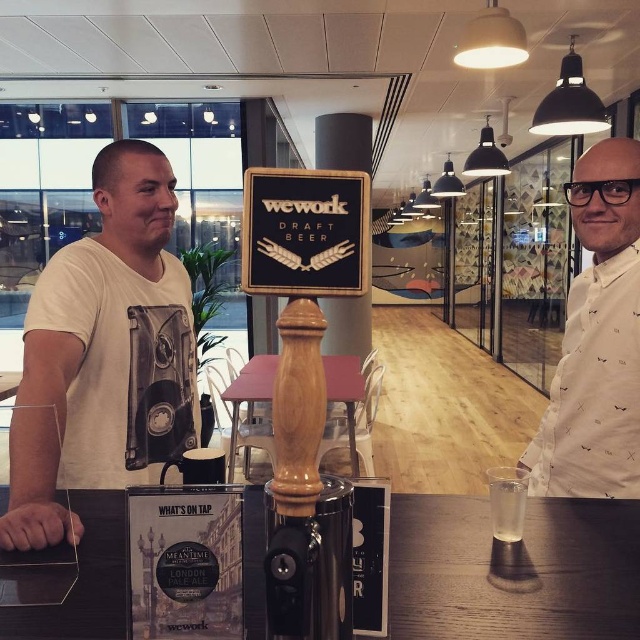
Can you confirm if white printed shirt at right is thinner than translucent glass at center?

Incorrect, white printed shirt at right's width is not less than translucent glass at center's.

From the picture: Is white printed shirt at right further to camera compared to translucent glass at center?

Yes, it is.

This screenshot has height=640, width=640. In order to click on white printed shirt at right in this screenshot , I will do `click(596, 340)`.

Can you confirm if white cotton t-shirt at left is positioned to the left of white printed shirt at right?

Correct, you'll find white cotton t-shirt at left to the left of white printed shirt at right.

Is white cotton t-shirt at left above white printed shirt at right?

No.

Which is behind, point (80, 419) or point (616, 401)?

The point (616, 401) is more distant.

Where is `white cotton t-shirt at left`? The width and height of the screenshot is (640, 640). white cotton t-shirt at left is located at coordinates (104, 355).

Which is behind, point (154, 230) or point (518, 524)?

The point (154, 230) is behind.

Identify the location of white cotton t-shirt at left. This screenshot has height=640, width=640. (104, 355).

Image resolution: width=640 pixels, height=640 pixels. What are the coordinates of `white cotton t-shirt at left` in the screenshot? It's located at (104, 355).